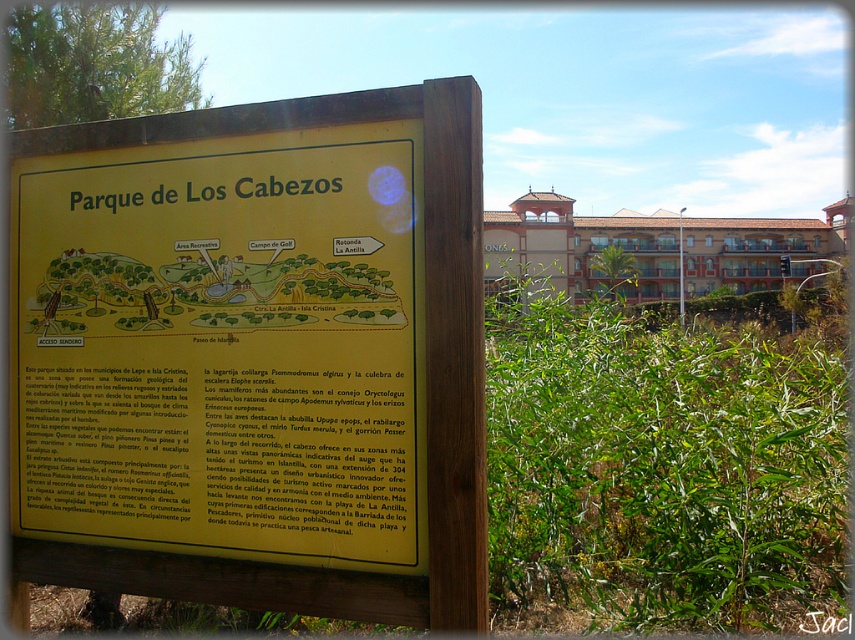
Is point (458, 179) positioned behind point (694, 573)?

No, (458, 179) is in front of (694, 573).

Does yellow matte sign at center have a greater width compared to green leafy plant at center?

In fact, yellow matte sign at center might be narrower than green leafy plant at center.

The image size is (855, 640). What do you see at coordinates (255, 356) in the screenshot?
I see `yellow matte sign at center` at bounding box center [255, 356].

Locate an element on the screen. yellow matte sign at center is located at coordinates (255, 356).